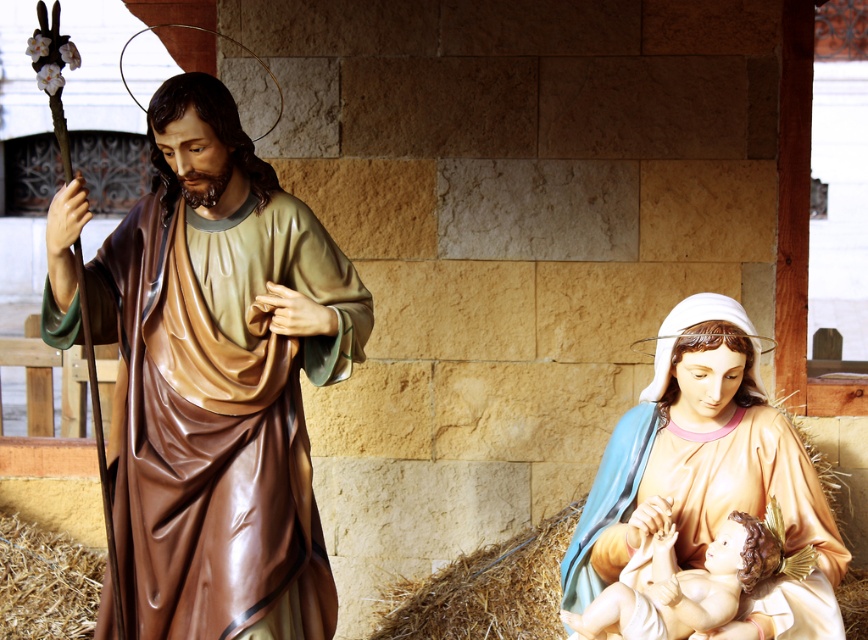
Question: Which point is farther to the camera?

Choices:
 (A) smooth porcelain baby at center
 (B) matte peach statue at lower right

Answer: (B)

Question: Can you confirm if matte peach statue at lower right is thinner than smooth porcelain baby at center?

Choices:
 (A) yes
 (B) no

Answer: (B)

Question: Considering the relative positions of brown glossy robe at left and matte peach statue at lower right in the image provided, where is brown glossy robe at left located with respect to matte peach statue at lower right?

Choices:
 (A) above
 (B) below

Answer: (A)

Question: Which object is positioned closest to the smooth porcelain baby at center?

Choices:
 (A) brown glossy robe at left
 (B) matte peach statue at lower right

Answer: (B)

Question: Can you confirm if matte peach statue at lower right is positioned to the right of smooth porcelain baby at center?

Choices:
 (A) no
 (B) yes

Answer: (B)

Question: Which point is farther to the camera?

Choices:
 (A) matte peach statue at lower right
 (B) smooth porcelain baby at center
 (C) brown glossy robe at left

Answer: (C)